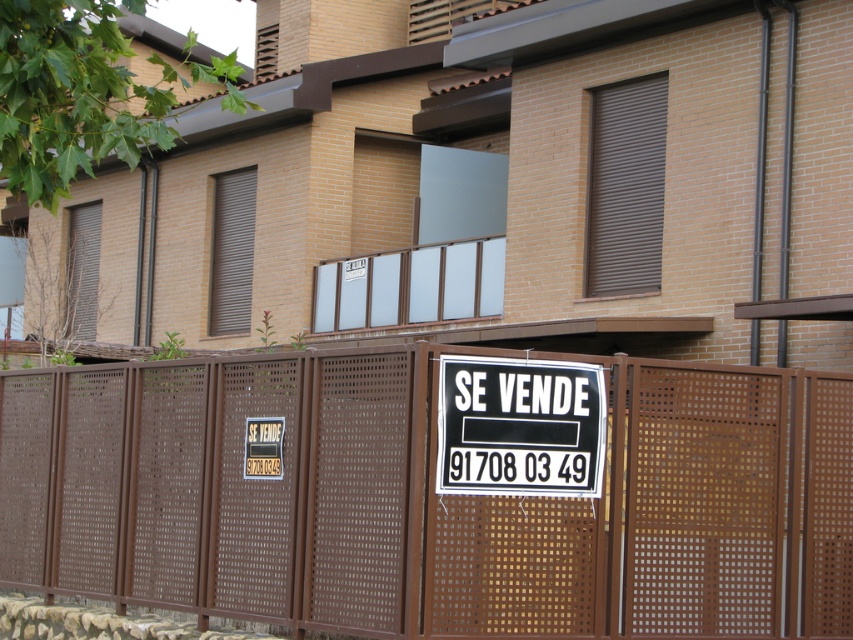
Between brown perforated fence at center and black paper sign at center, which one appears on the right side from the viewer's perspective?

Positioned to the right is black paper sign at center.

Between brown perforated fence at center and black paper sign at center, which one is positioned lower?

brown perforated fence at center is lower down.

The height and width of the screenshot is (640, 853). Describe the element at coordinates (434, 493) in the screenshot. I see `brown perforated fence at center` at that location.

Find the location of a particular element. The width and height of the screenshot is (853, 640). brown perforated fence at center is located at coordinates (434, 493).